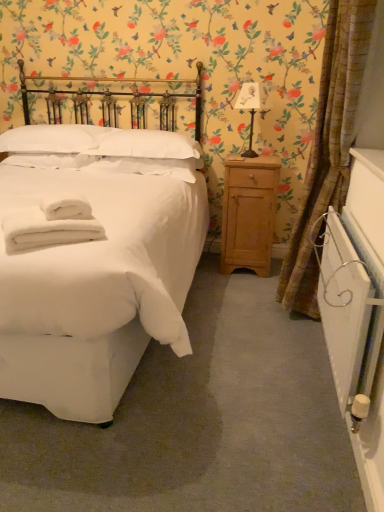
Question: From a real-world perspective, is white cotton bed at left on top of light wood/roughnightstand at right?

Choices:
 (A) no
 (B) yes

Answer: (B)

Question: Is white cotton bed at left located outside light wood/roughnightstand at right?

Choices:
 (A) no
 (B) yes

Answer: (B)

Question: Can you confirm if white cotton bed at left is taller than light wood/roughnightstand at right?

Choices:
 (A) yes
 (B) no

Answer: (A)

Question: From the image's perspective, does white cotton bed at left appear lower than light wood/roughnightstand at right?

Choices:
 (A) yes
 (B) no

Answer: (B)

Question: From a real-world perspective, is white cotton bed at left under light wood/roughnightstand at right?

Choices:
 (A) no
 (B) yes

Answer: (A)

Question: Visually, is white paper lampshade at upper right positioned to the left or to the right of white cotton bed at left?

Choices:
 (A) left
 (B) right

Answer: (B)

Question: Is point (253, 110) closer or farther from the camera than point (110, 415)?

Choices:
 (A) farther
 (B) closer

Answer: (A)

Question: Based on their sizes in the image, would you say white paper lampshade at upper right is bigger or smaller than white cotton bed at left?

Choices:
 (A) big
 (B) small

Answer: (B)

Question: From the image's perspective, relative to white cotton bed at left, is white paper lampshade at upper right above or below?

Choices:
 (A) below
 (B) above

Answer: (B)

Question: Which is correct: white paper lampshade at upper right is inside white soft towel at lower left, or outside of it?

Choices:
 (A) inside
 (B) outside

Answer: (B)

Question: Would you say white paper lampshade at upper right is to the left or to the right of white soft towel at lower left in the picture?

Choices:
 (A) right
 (B) left

Answer: (A)

Question: From the image's perspective, is white paper lampshade at upper right located above or below white soft towel at lower left?

Choices:
 (A) below
 (B) above

Answer: (B)

Question: Is white paper lampshade at upper right wider or thinner than white soft towel at lower left?

Choices:
 (A) thin
 (B) wide

Answer: (A)

Question: From the image's perspective, is white paper lampshade at upper right positioned above or below white soft pillow at upper center, which is the second pillow in left-to-right order?

Choices:
 (A) below
 (B) above

Answer: (B)

Question: From a real-world perspective, is white paper lampshade at upper right above or below white soft pillow at upper center, the 1th pillow positioned from the right?

Choices:
 (A) below
 (B) above

Answer: (B)